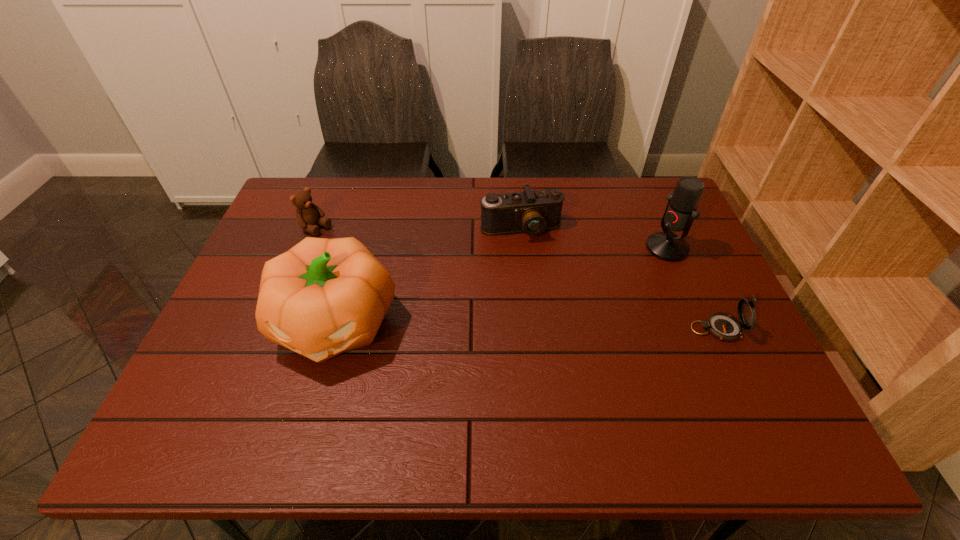
I want to click on free point between the compass and the microphone, so click(691, 288).

I want to click on vacant point located between the camera and the microphone, so click(594, 239).

At what (x,y) coordinates should I click in order to perform the action: click on empty location between the pumpkin and the camera. Please return your answer as a coordinate pair (x, y). This screenshot has height=540, width=960. Looking at the image, I should click on (428, 276).

The height and width of the screenshot is (540, 960). In order to click on empty space between the pumpkin and the compass in this screenshot , I will do `click(526, 326)`.

Identify the location of vacant space that's between the compass and the microphone. The image size is (960, 540). (691, 288).

At what (x,y) coordinates should I click in order to perform the action: click on free space between the microphone and the teddy bear. Please return your answer as a coordinate pair (x, y). The image size is (960, 540). Looking at the image, I should click on (492, 238).

Where is `vacant space that's between the compass and the teddy bear`? This screenshot has width=960, height=540. vacant space that's between the compass and the teddy bear is located at coordinates (516, 279).

This screenshot has height=540, width=960. I want to click on the second closest object to the pumpkin, so click(532, 212).

Identify which object is located as the third nearest to the teddy bear. Please provide its 2D coordinates. Your answer should be formatted as a tuple, i.e. [(x, y)], where the tuple contains the x and y coordinates of a point satisfying the conditions above.

[(680, 212)]

You are a GUI agent. You are given a task and a screenshot of the screen. Output one action in this format:
    pyautogui.click(x=<x>, y=<y>)
    Task: Click on the free space in the image that satisfies the following two spatial constraints: 1. on the carved face of the pumpkin; 2. on the face of the compass
    This screenshot has height=540, width=960.
    Given the screenshot: What is the action you would take?
    pyautogui.click(x=334, y=329)